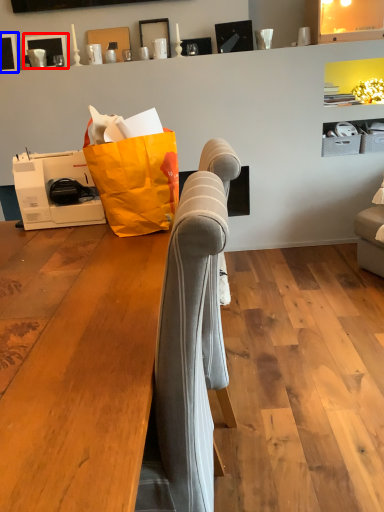
Question: Which object appears closest to the camera in this image, picture frame (highlighted by a red box) or picture frame (highlighted by a blue box)?

Choices:
 (A) picture frame
 (B) picture frame

Answer: (B)